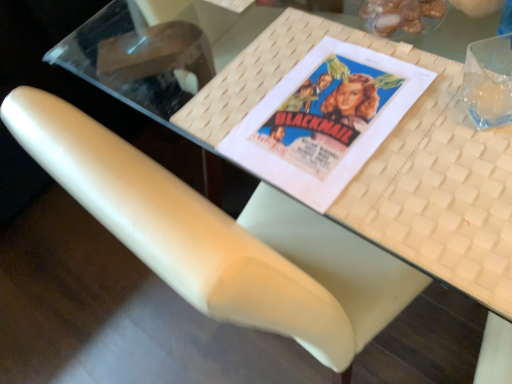
Question: Choose the correct answer: Is white leather chair at center inside shiny brown nuts at upper right or outside it?

Choices:
 (A) inside
 (B) outside

Answer: (B)

Question: Looking at the image, does white leather chair at center seem bigger or smaller compared to shiny brown nuts at upper right?

Choices:
 (A) small
 (B) big

Answer: (B)

Question: Estimate the real-world distances between objects in this image. Which object is farther from the matte paper movie poster at center?

Choices:
 (A) white leather chair at center
 (B) shiny brown nuts at upper right
 (C) white woven placemat at upper center

Answer: (A)

Question: Which object is positioned closest to the shiny brown nuts at upper right?

Choices:
 (A) matte paper movie poster at center
 (B) white leather chair at center
 (C) white woven placemat at upper center

Answer: (A)